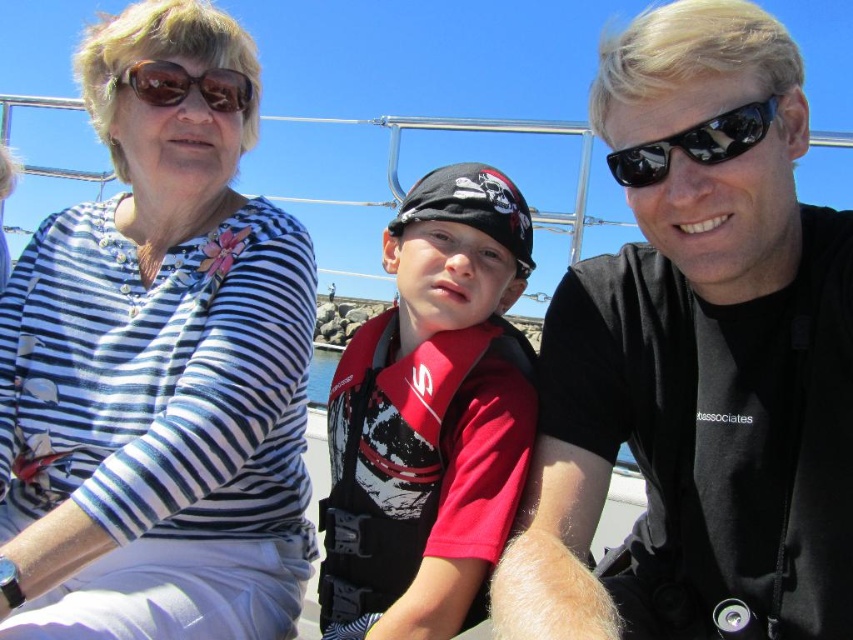
Question: Which is farther from the sunglasses at right?

Choices:
 (A) white striped shirt at upper left
 (B) black matte shirt at center
 (C) brown reflective sunglasses at upper left
 (D) red life vest at center

Answer: (A)

Question: Among these objects, which one is nearest to the camera?

Choices:
 (A) brown reflective sunglasses at upper left
 (B) sunglasses at right

Answer: (B)

Question: Can you confirm if black matte shirt at center is positioned below brown reflective sunglasses at upper left?

Choices:
 (A) yes
 (B) no

Answer: (A)

Question: Is red life vest at center above sunglasses at right?

Choices:
 (A) yes
 (B) no

Answer: (B)

Question: Can you confirm if black matte shirt at center is positioned above brown reflective sunglasses at upper left?

Choices:
 (A) no
 (B) yes

Answer: (A)

Question: Among these objects, which one is nearest to the camera?

Choices:
 (A) brown reflective sunglasses at upper left
 (B) black matte shirt at center

Answer: (B)